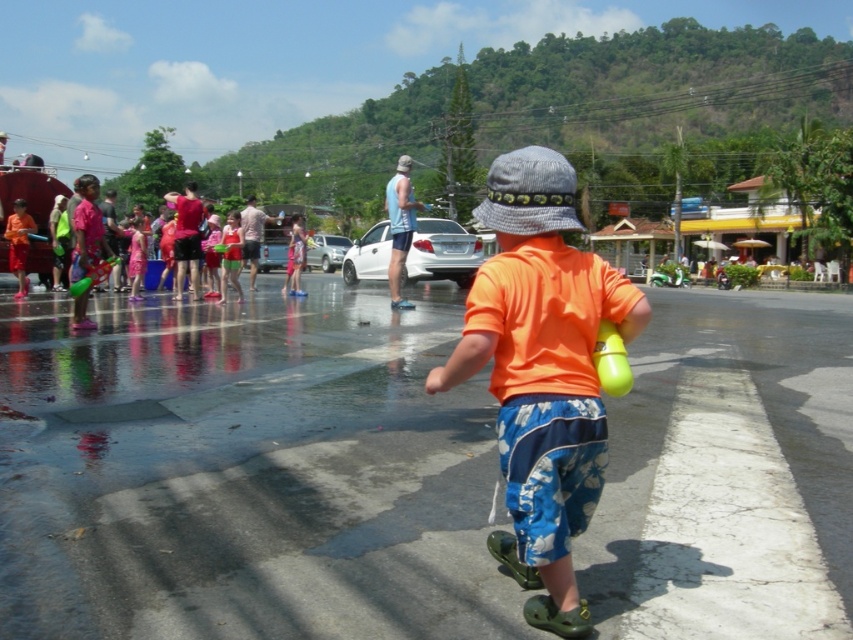
You are standing in the scene and see the blue fabric tank top at center and the translucent yellow balloon at center. Which object is closer to you?

The blue fabric tank top at center is closer to you because the translucent yellow balloon at center is behind it.

Based on the scene description, where is the orange matte shirt at center located in terms of coordinates?

The orange matte shirt at center is located at coordinates point (543, 372).